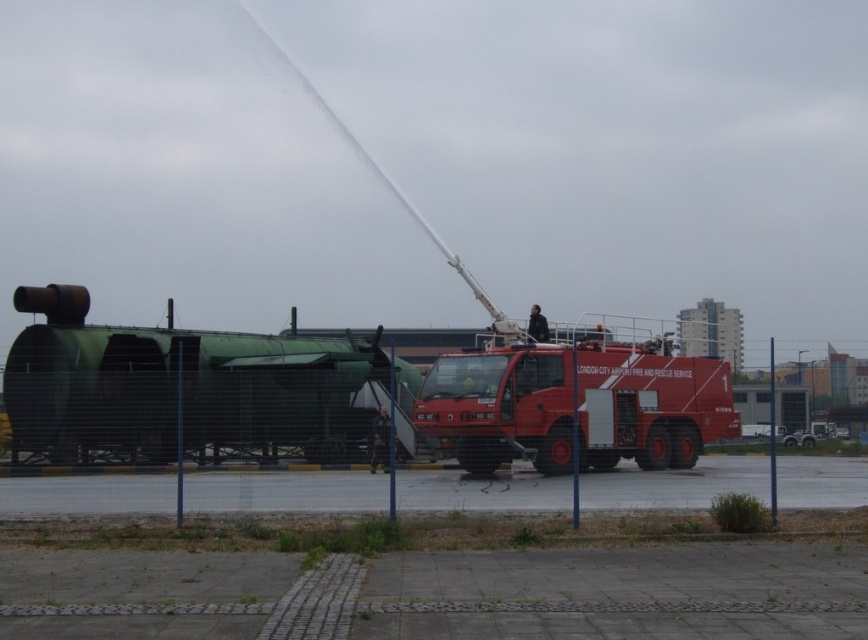
Is green matte tank at left above matte red fire truck at center?

Indeed, green matte tank at left is positioned over matte red fire truck at center.

Between point (122, 381) and point (667, 342), which one is positioned behind?

The point (667, 342) is more distant.

Locate an element on the screen. The height and width of the screenshot is (640, 868). green matte tank at left is located at coordinates (182, 385).

Locate an element on the screen. The height and width of the screenshot is (640, 868). green matte tank at left is located at coordinates (182, 385).